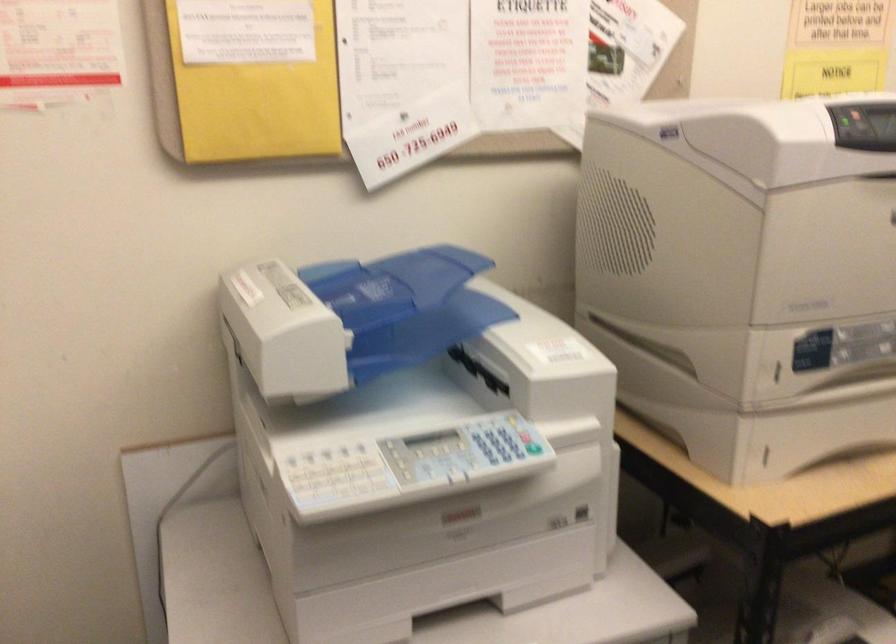
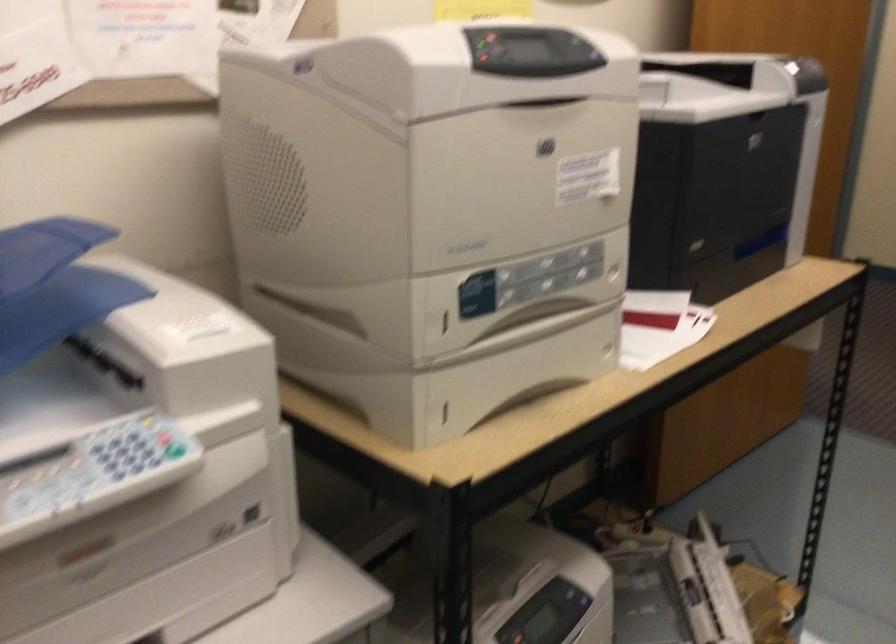
In a continuous first-person perspective shot, in which direction is the camera moving?

The cameraman moved toward right, forward.